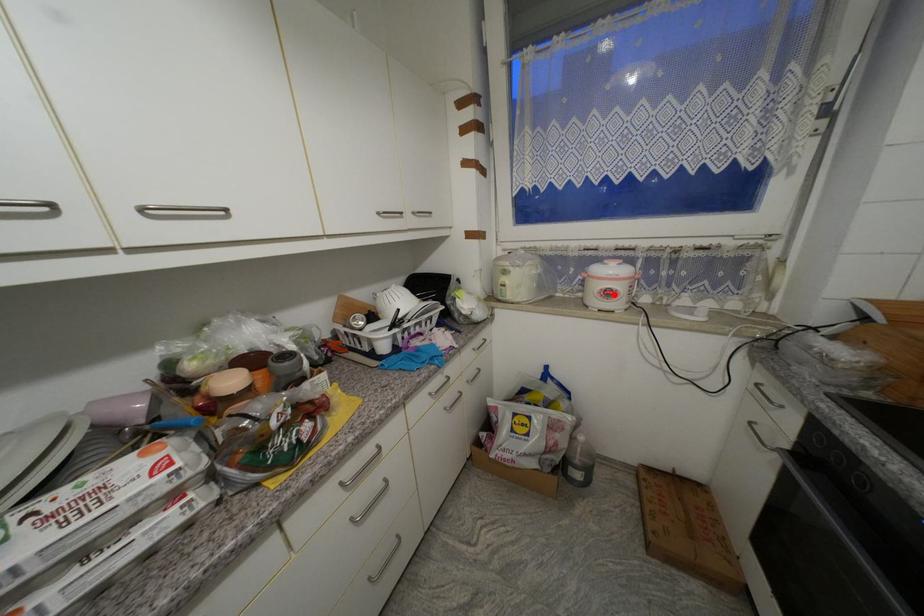
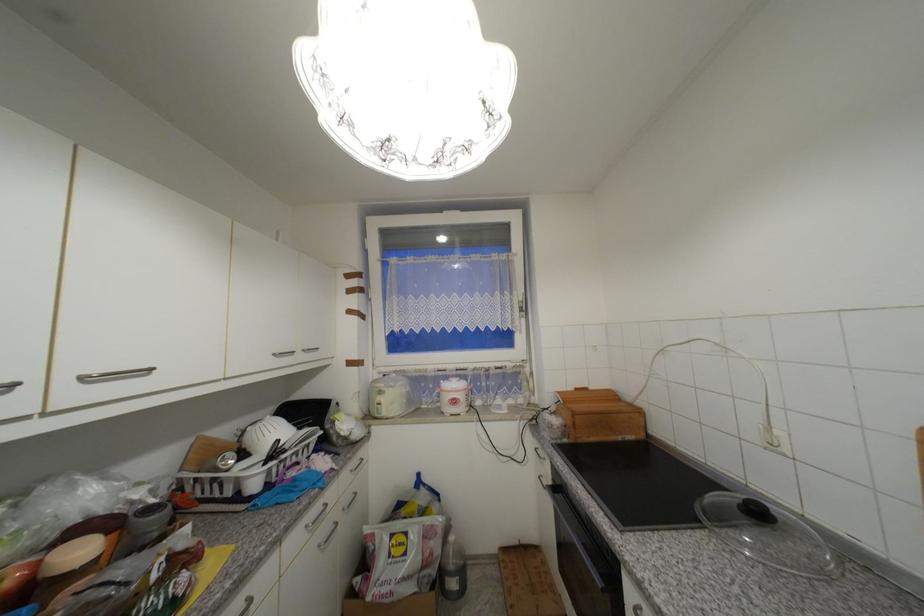
Question: I am providing you with two images of the same scene from different viewpoints. Image1 has a red point marked. In image2, the corresponding 3D location appears at what relative position? Reply with the corresponding letter.

Choices:
 (A) Closer
 (B) Farther

Answer: (B)